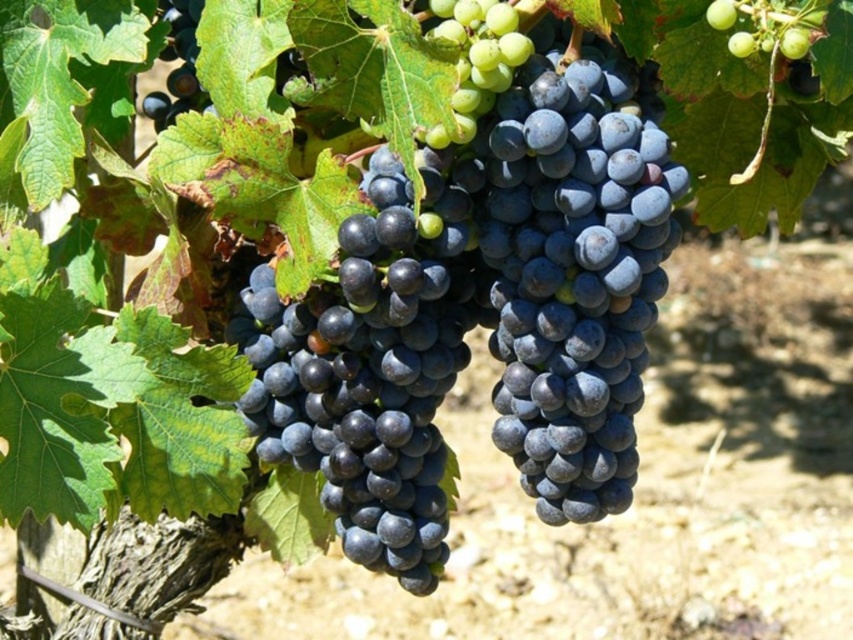
Question: Which of the following is the closest to the observer?

Choices:
 (A) (782, 52)
 (B) (631, 330)
 (C) (190, 90)

Answer: (A)

Question: Among these points, which one is farthest from the camera?

Choices:
 (A) (817, 32)
 (B) (360, 545)

Answer: (B)

Question: Can you confirm if shiny dark blue grapes at center is positioned above shiny dark blue grape at upper left?

Choices:
 (A) yes
 (B) no

Answer: (B)

Question: Is shiny dark blue grapes at center further to the viewer compared to shiny dark blue grape at upper left?

Choices:
 (A) no
 (B) yes

Answer: (A)

Question: Is green matte grape at upper center to the right of shiny dark blue grape at upper left from the viewer's perspective?

Choices:
 (A) no
 (B) yes

Answer: (B)

Question: Which object is farther from the camera taking this photo?

Choices:
 (A) shiny dark blue grape at upper left
 (B) shiny dark blue grapes at center

Answer: (A)